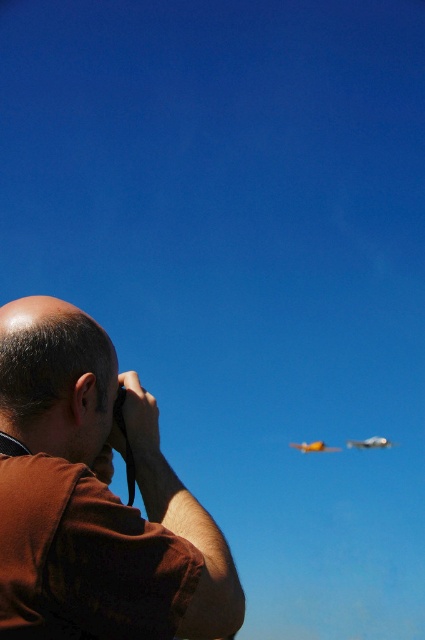
You are a photographer trying to capture the metallic silver airplane at upper right. You notice the brown fabric shirt at left is blocking part of your view. Based on the scene, can you determine if the shirt is taller than the airplane in the frame?

The brown fabric shirt at left has a greater height compared to the metallic silver airplane at upper right, so yes, the shirt is taller and blocking the view.

You are a photographer standing at the location of the brown fabric shirt at left. You want to take a photo of the yellow matte airplane at lower center. Given that your camera has a maximum focus range of 60 feet, will you be able to focus on the airplane?

The distance between the brown fabric shirt at left and the yellow matte airplane at lower center is 68.67 feet, which exceeds the camera maximum focus range of 60 feet. Therefore, you will not be able to focus on the airplane.